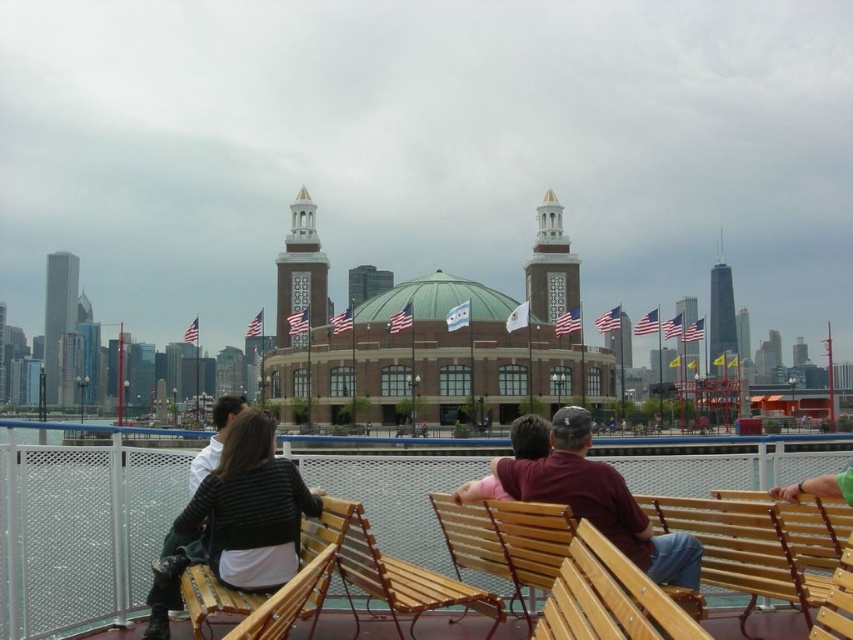
You are standing on the ferry deck and notice a striped sweater at center and a wooden bench at center. Which object is closer to the left side of the scene?

The striped sweater at center is to the left of the wooden bench at center, so it is closer to the left side of the scene.